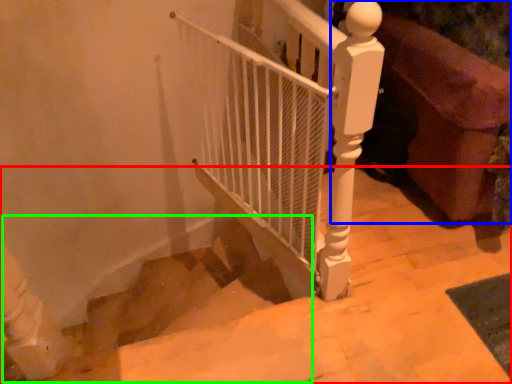
Question: Based on their relative distances, which object is farther from stairs (highlighted by a red box)? Choose from furniture (highlighted by a blue box) and stairwell (highlighted by a green box).

Choices:
 (A) furniture
 (B) stairwell

Answer: (B)